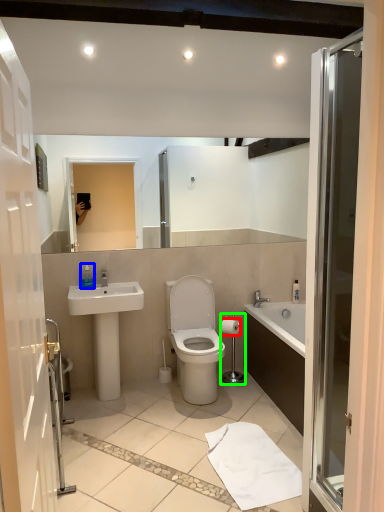
Question: Considering the real-world distances, which object is closest to toilet paper (highlighted by a red box)? toiletry (highlighted by a blue box) or towel bar (highlighted by a green box).

Choices:
 (A) toiletry
 (B) towel bar

Answer: (B)